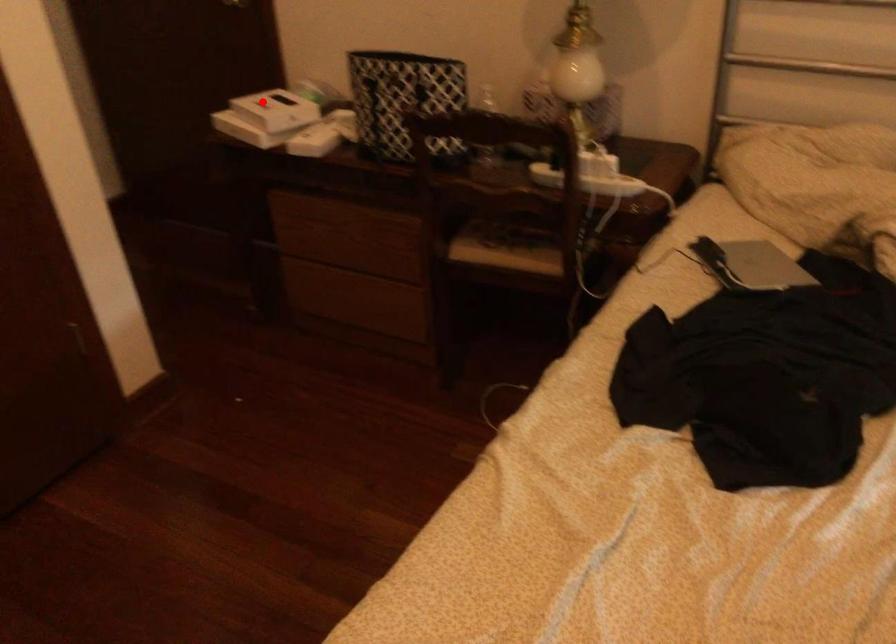
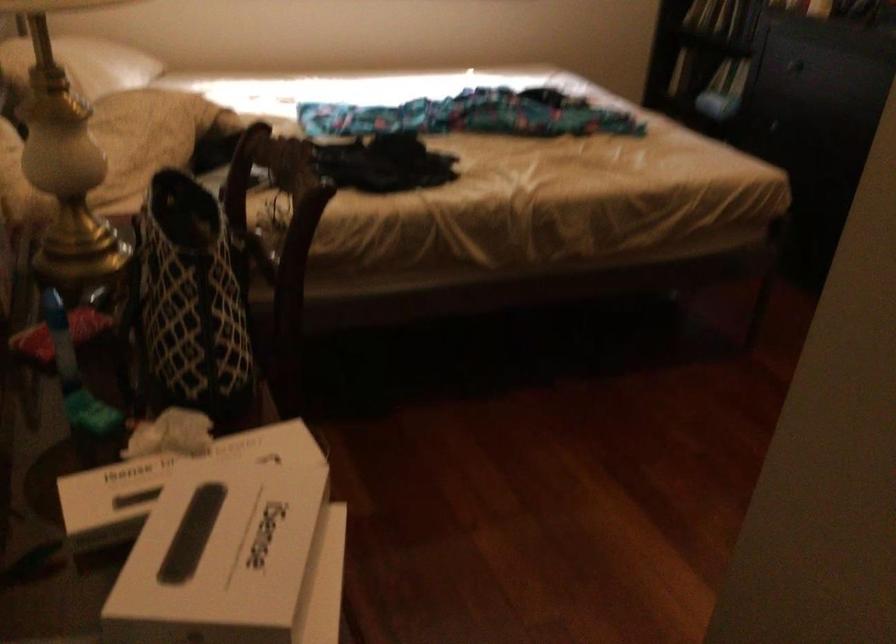
Question: A red point is marked in image1. In image2, is the corresponding 3D point closer to the camera or farther? Reply with the corresponding letter.

Choices:
 (A) The corresponding 3D point is closer.
 (B) The corresponding 3D point is farther.

Answer: (A)